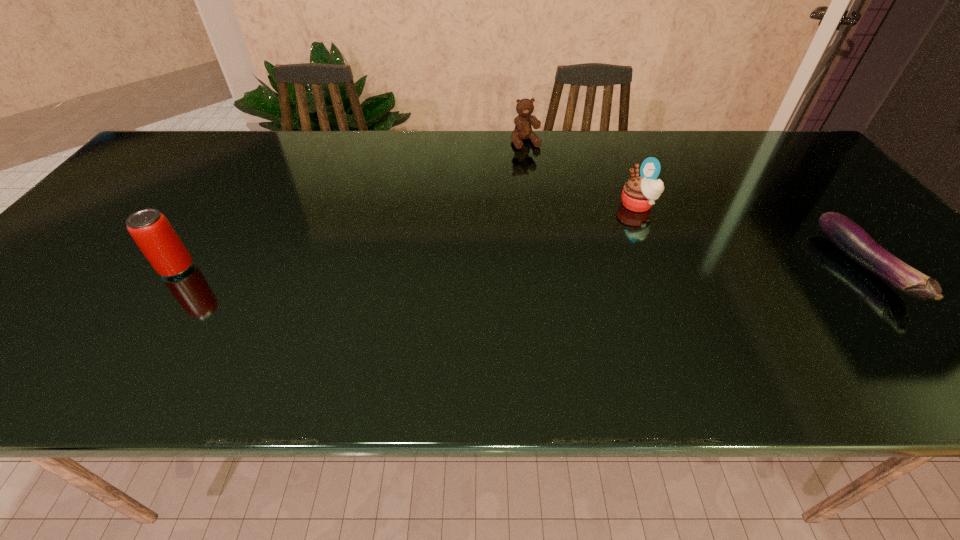
This screenshot has width=960, height=540. Identify the location of vacant space located on the face of the second object from left to right. (550, 189).

You are a GUI agent. You are given a task and a screenshot of the screen. Output one action in this format:
    pyautogui.click(x=<x>, y=<y>)
    Task: Click on the vacant position located on the face of the second object from left to right
    This screenshot has height=540, width=960.
    Given the screenshot: What is the action you would take?
    point(542,175)

The width and height of the screenshot is (960, 540). In order to click on free space located 0.310m on the front-facing side of the third object from left to right in this screenshot , I will do `click(530, 256)`.

Locate an element on the screen. free space located 0.400m on the front-facing side of the third object from left to right is located at coordinates (498, 271).

At what (x,y) coordinates should I click in order to perform the action: click on vacant area situated 0.320m on the front-facing side of the third object from left to right. Please return your answer as a coordinate pair (x, y). This screenshot has height=540, width=960. Looking at the image, I should click on (526, 258).

You are a GUI agent. You are given a task and a screenshot of the screen. Output one action in this format:
    pyautogui.click(x=<x>, y=<y>)
    Task: Click on the object that is at the far edge
    
    Given the screenshot: What is the action you would take?
    pyautogui.click(x=523, y=130)

The width and height of the screenshot is (960, 540). I want to click on object at the near edge, so click(852, 240).

Where is `object located at the right edge`? object located at the right edge is located at coordinates (852, 240).

At what (x,y) coordinates should I click in order to perform the action: click on object positioned at the near right corner. Please return your answer as a coordinate pair (x, y). This screenshot has height=540, width=960. Looking at the image, I should click on (852, 240).

Find the location of `free space at the far edge of the desktop`. free space at the far edge of the desktop is located at coordinates (699, 137).